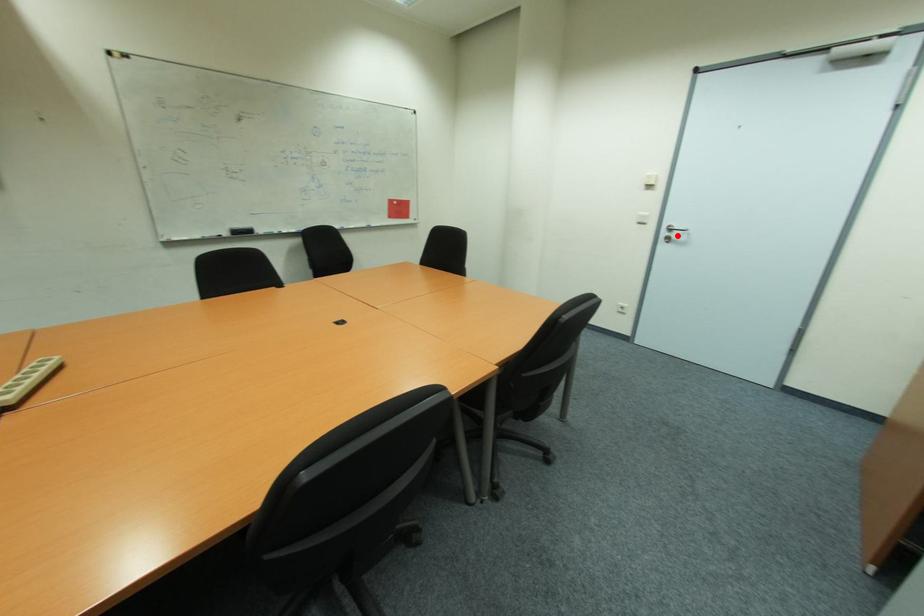
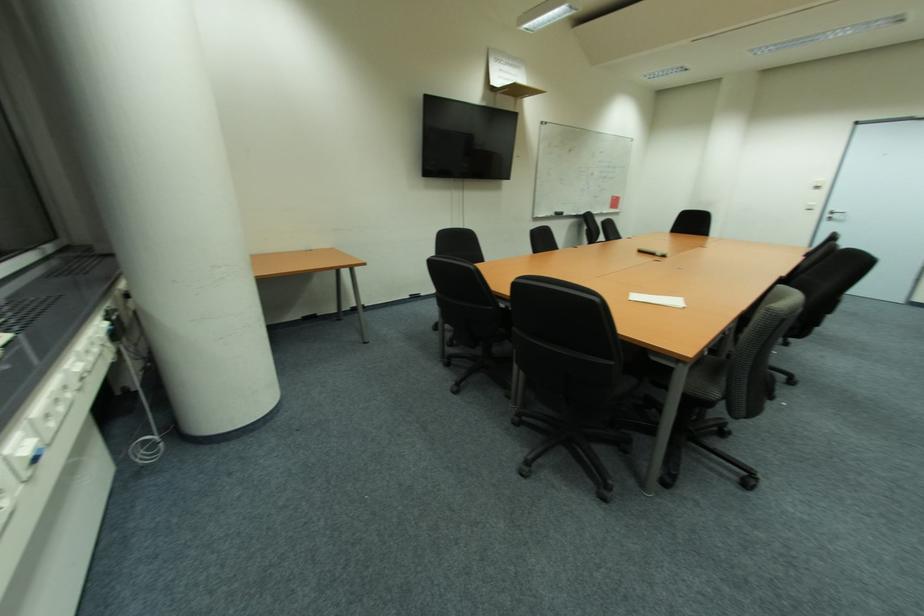
In the second image, find the point that corresponds to the highlighted location in the first image.

(842, 217)